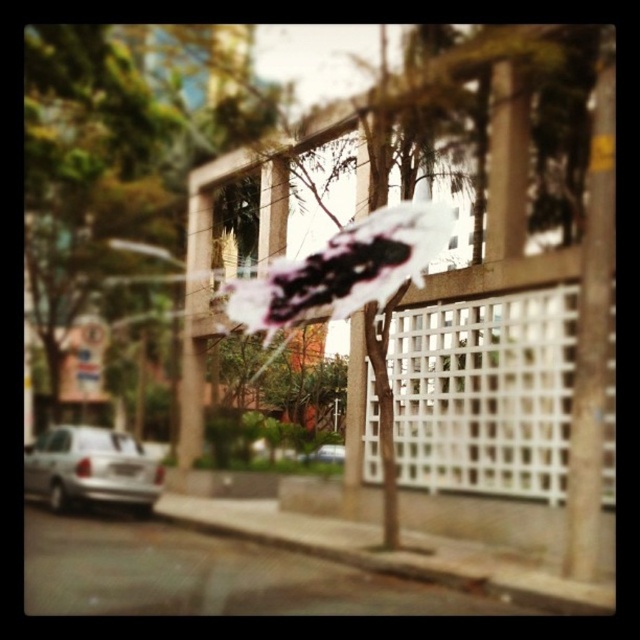
You are a delivery drone flying over an urban area. You need to navigate between two points marked as point (397, 480) and point (568, 493). According to the scene, which point is closer to the drone if it is positioned at the same level as the fence?

Point (568, 493) is closer to the drone because it is in front of point (397, 480), which is behind it.

You are standing on the sidewalk in the urban street scene. You see the gray concrete curb at lower center represented by point (x=390, y=552). If you want to walk towards the parked silver car on the left side of the frame, which direction should you move relative to the curb?

The gray concrete curb at lower center is represented by point (x=390, y=552). To reach the parked silver car on the left side of the frame, you should move to the left relative to the curb.